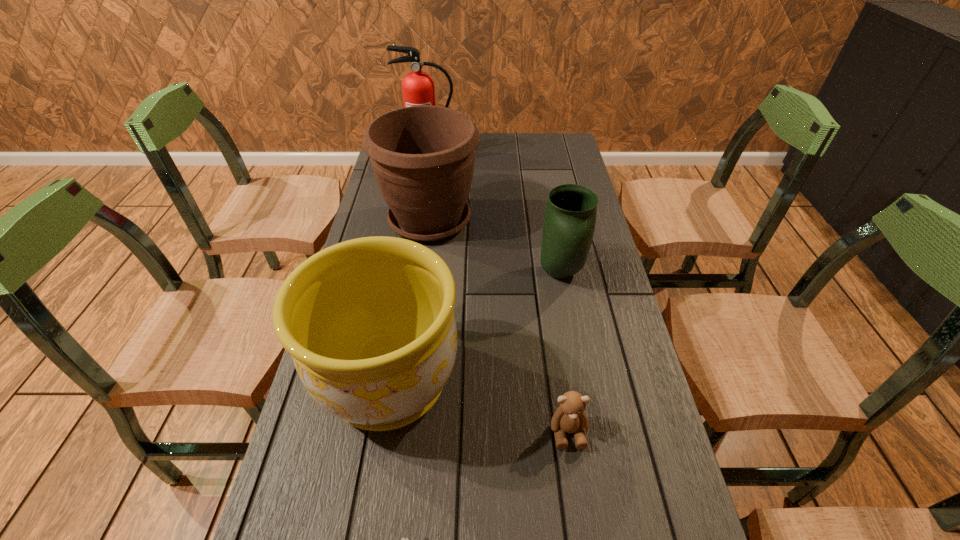
You are a GUI agent. You are given a task and a screenshot of the screen. Output one action in this format:
    pyautogui.click(x=<x>, y=<y>)
    Task: Click on the empty location between the farther flowerpot and the teddy bear
    The image size is (960, 540).
    Given the screenshot: What is the action you would take?
    pyautogui.click(x=499, y=326)

You are a GUI agent. You are given a task and a screenshot of the screen. Output one action in this format:
    pyautogui.click(x=<x>, y=<y>)
    Task: Click on the third closest object to the fifth tallest object
    Image resolution: width=960 pixels, height=540 pixels.
    Given the screenshot: What is the action you would take?
    pyautogui.click(x=570, y=216)

Identify which object is located as the third nearest to the vase. Please provide its 2D coordinates. Your answer should be formatted as a tuple, i.e. [(x, y)], where the tuple contains the x and y coordinates of a point satisfying the conditions above.

[(569, 417)]